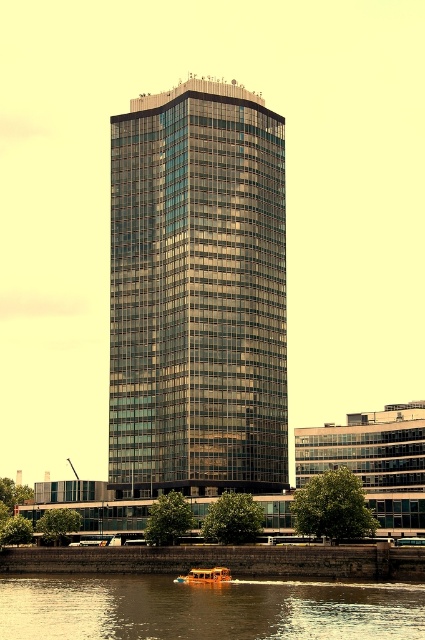
Between glassy metallic skyscraper at center and orange polished wood boat at lower center, which one has more height?

Standing taller between the two is glassy metallic skyscraper at center.

Is glassy metallic skyscraper at center above orange polished wood boat at lower center?

Correct, glassy metallic skyscraper at center is located above orange polished wood boat at lower center.

Who is more distant from viewer, (144, 369) or (206, 579)?

The point (144, 369) is behind.

The width and height of the screenshot is (425, 640). Identify the location of glassy metallic skyscraper at center. (198, 292).

Between point (170, 321) and point (76, 636), which one is positioned in front?

Point (76, 636) is in front.

Can you confirm if glassy metallic skyscraper at center is shorter than brown water at lower center?

In fact, glassy metallic skyscraper at center may be taller than brown water at lower center.

Identify the location of glassy metallic skyscraper at center. (198, 292).

Locate an element on the screen. The width and height of the screenshot is (425, 640). glassy metallic skyscraper at center is located at coordinates (198, 292).

Measure the distance between brown water at lower center and orange polished wood boat at lower center.

14.91 meters

Between brown water at lower center and orange polished wood boat at lower center, which one is positioned lower?

orange polished wood boat at lower center is below.

This screenshot has height=640, width=425. What are the coordinates of `brown water at lower center` in the screenshot? It's located at (206, 609).